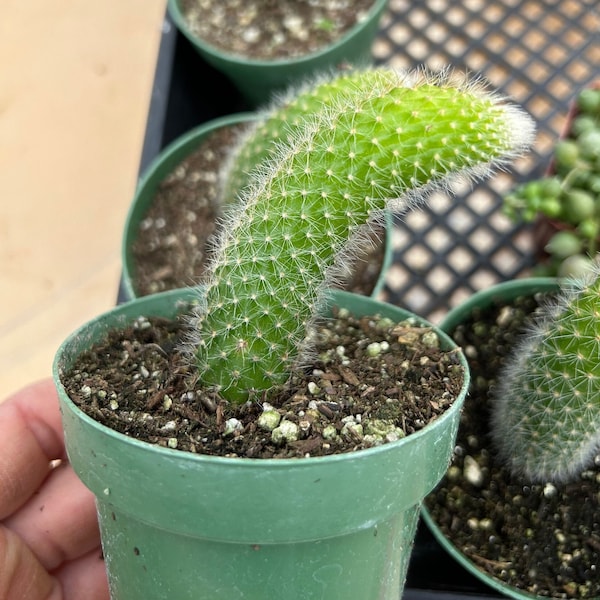
You are a GUI agent. You are given a task and a screenshot of the screen. Output one action in this format:
    pyautogui.click(x=<x>, y=<y>)
    Task: Click on the plant
    The height and width of the screenshot is (600, 600).
    Given the screenshot: What is the action you would take?
    click(583, 423)